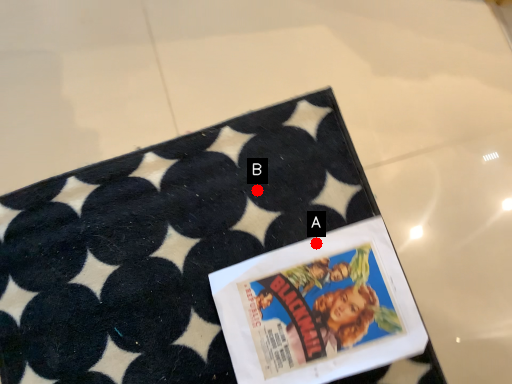
Question: Two points are circled on the image, labeled by A and B beside each circle. Among these points, which one is nearest to the camera?

Choices:
 (A) A is closer
 (B) B is closer

Answer: (A)